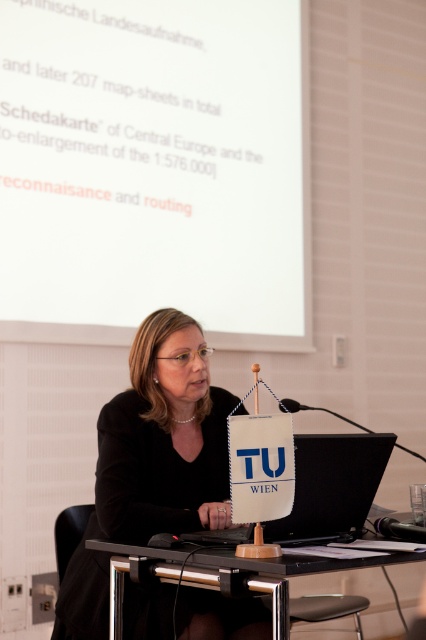
What is located at the coordinates point (163, 440) in the image?

The point (163, 440) indicates the location of the black matte jacket at center.

You are a photographer trying to capture a clear shot of the black matte laptop at center during the presentation. However, there is an obstruction from the black matte jacket at center. Based on their sizes, can you determine if the jacket will block the laptop from view?

The black matte jacket at center is much taller than the black matte laptop at center, so it will likely block the laptop from view.

You are an attendee at this presentation. You notice the white matte projection screen at upper center and the black matte jacket at center. Which object is wider?

The white matte projection screen at upper center is wider than the black matte jacket at center.